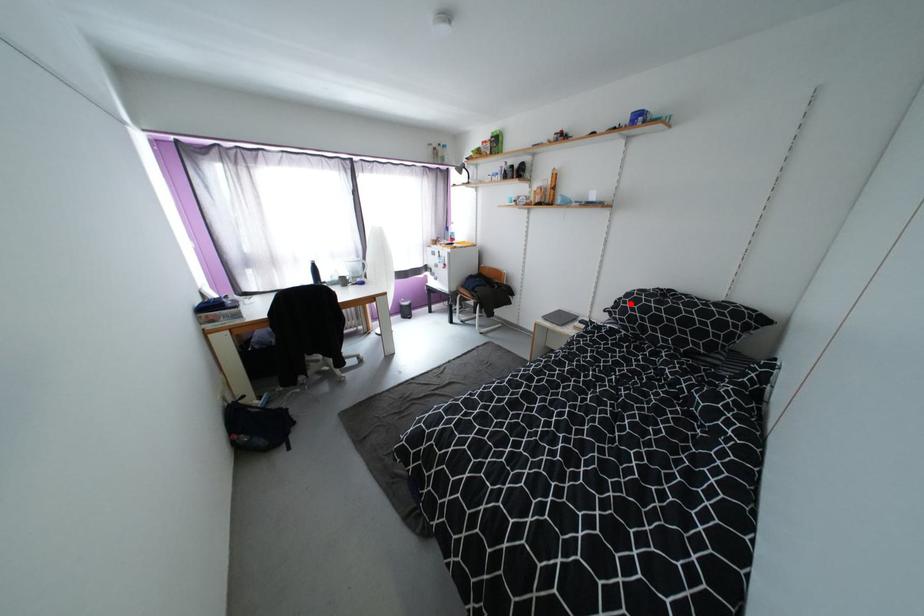
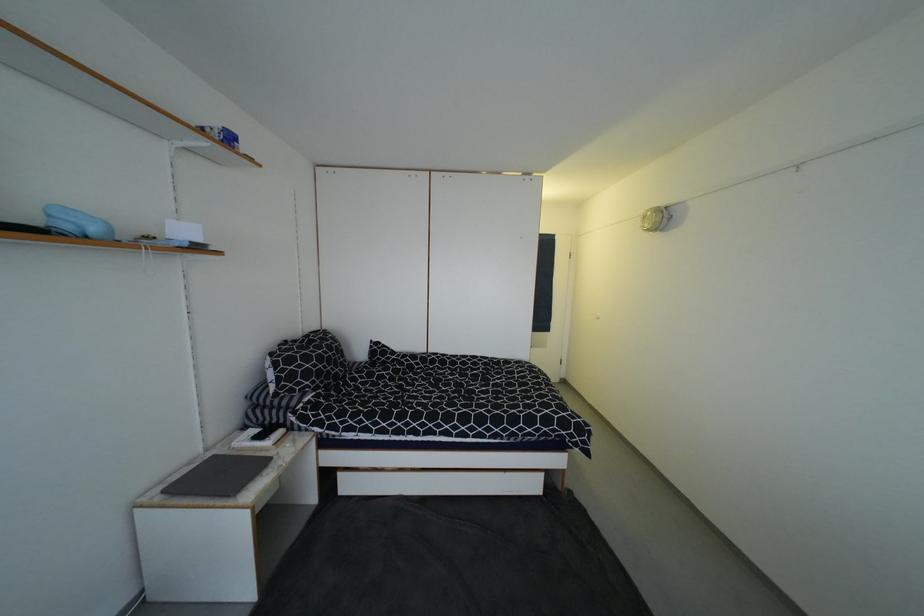
Where in the second image is the point corresponding to the highlighted location from the first image?

(305, 368)